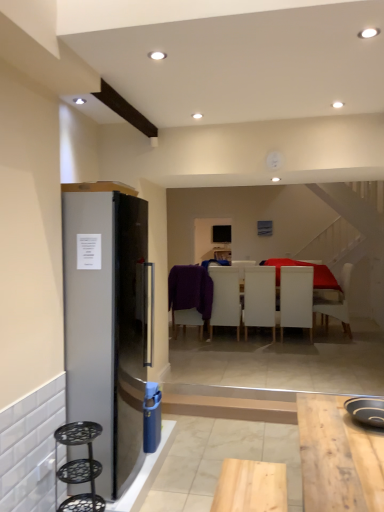
Describe the element at coordinates (225, 298) in the screenshot. I see `white matte chair at center, which ranks as the 2th chair in left-to-right order` at that location.

At what (x,y) coordinates should I click in order to perform the action: click on satin silver refrigerator at left. Please return your answer as a coordinate pair (x, y). This screenshot has height=512, width=384. Looking at the image, I should click on (105, 323).

You are a GUI agent. You are given a task and a screenshot of the screen. Output one action in this format:
    pyautogui.click(x=<x>, y=<y>)
    Task: Click on the purple fabric chair at center, which is the first chair in left-to-right order
    The width and height of the screenshot is (384, 512).
    Given the screenshot: What is the action you would take?
    pos(190,296)

Measure the distance between purple fabric chair at center, which ranks as the 5th chair in right-to-left order, and camera.

The distance of purple fabric chair at center, which ranks as the 5th chair in right-to-left order, from camera is 5.98 meters.

Measure the distance between point (x=75, y=424) and camera.

They are 2.39 meters apart.

The width and height of the screenshot is (384, 512). I want to click on white matte chair at center, which is the third chair from left to right, so click(x=260, y=298).

Looking at this image, are white matte chair at center, which is counted as the fourth chair, starting from the right, and purple fabric chair at center, which is the first chair in left-to-right order, far apart?

white matte chair at center, which is counted as the fourth chair, starting from the right, is near purple fabric chair at center, which is the first chair in left-to-right order, not far away.

Can you confirm if white matte chair at center, which ranks as the 2th chair in left-to-right order, is thinner than purple fabric chair at center, which is the first chair in left-to-right order?

No, white matte chair at center, which ranks as the 2th chair in left-to-right order, is not thinner than purple fabric chair at center, which is the first chair in left-to-right order.

Is white matte chair at center, which ranks as the 2th chair in left-to-right order, positioned with its back to purple fabric chair at center, which ranks as the 5th chair in right-to-left order?

white matte chair at center, which ranks as the 2th chair in left-to-right order, is not turned away from purple fabric chair at center, which ranks as the 5th chair in right-to-left order.

Is point (209, 330) closer to viewer compared to point (202, 294)?

That is False.

Does satin silver refrigerator at left have a greater width compared to white matte chair at center, which is the third chair from left to right?

Indeed, satin silver refrigerator at left has a greater width compared to white matte chair at center, which is the third chair from left to right.

From the image's perspective, is satin silver refrigerator at left positioned above or below white matte chair at center, which is the third chair from left to right?

satin silver refrigerator at left is above white matte chair at center, which is the third chair from left to right.

Looking at this image, from a real-world perspective, between satin silver refrigerator at left and white matte chair at center, which is the third chair from left to right, who is vertically lower?

From a 3D spatial view, white matte chair at center, which is the third chair from left to right, is below.

Which point is more forward, [74,462] or [189,297]?

Point [74,462]

Is black metal bar stool at left beside purple fabric chair at center, which is the first chair in left-to-right order?

There is a gap between black metal bar stool at left and purple fabric chair at center, which is the first chair in left-to-right order.

Which object is closer to the camera, black metal bar stool at left or purple fabric chair at center, which is the first chair in left-to-right order?

black metal bar stool at left is closer to the camera.

Which is more to the left, white matte chair at center, which is the third chair from left to right, or purple fabric chair at center, which is the first chair in left-to-right order?

Positioned to the left is purple fabric chair at center, which is the first chair in left-to-right order.

At what (x,y) coordinates should I click in order to perform the action: click on the 3rd chair positioned below the white matte chair at center, which is the third chair from left to right (from the image's perspective). Please return your answer as a coordinate pair (x, y). Looking at the image, I should click on (190, 296).

Can you confirm if white matte chair at center, which is the third chair from left to right, is shorter than purple fabric chair at center, which ranks as the 5th chair in right-to-left order?

No, white matte chair at center, which is the third chair from left to right, is not shorter than purple fabric chair at center, which ranks as the 5th chair in right-to-left order.

Can we say white matte chair at center, the third chair viewed from the right, lies outside purple fabric chair at center, which is the first chair in left-to-right order?

Indeed, white matte chair at center, the third chair viewed from the right, is completely outside purple fabric chair at center, which is the first chair in left-to-right order.

Does point (287, 297) come in front of point (247, 309)?

Yes, it is in front of point (247, 309).

Considering the relative positions of white matte chair at center, placed as the second chair when sorted from right to left, and white matte chair at center, the third chair viewed from the right, in the image provided, is white matte chair at center, placed as the second chair when sorted from right to left, to the left or to the right of white matte chair at center, the third chair viewed from the right,?

→ From the image, it's evident that white matte chair at center, placed as the second chair when sorted from right to left, is to the right of white matte chair at center, the third chair viewed from the right.

Are white matte chair at center, which appears as the fourth chair when viewed from the left, and white matte chair at center, which is the third chair from left to right, far apart?

white matte chair at center, which appears as the fourth chair when viewed from the left, is near white matte chair at center, which is the third chair from left to right, not far away.

Does white matte chair at center, placed as the second chair when sorted from right to left, lie in front of white matte chair at center, the third chair viewed from the right?

That is True.

Which chair is the 5th one when counting from the back of the satin silver refrigerator at left? Please provide its 2D coordinates.

[(335, 303)]

Is point (138, 455) closer to viewer compared to point (340, 320)?

Yes, it is.

From the image's perspective, relative to white matte chair at center, the fifth chair positioned from the left, is satin silver refrigerator at left above or below?

Based on their image positions, satin silver refrigerator at left is located above white matte chair at center, the fifth chair positioned from the left.

From a real-world perspective, relative to white matte chair at center, which appears as the fourth chair when viewed from the left, is white matte chair at center, the third chair viewed from the right, vertically above or below?

From a real-world perspective, white matte chair at center, the third chair viewed from the right, is physically above white matte chair at center, which appears as the fourth chair when viewed from the left.

Is white matte chair at center, the third chair viewed from the right, taller or shorter than white matte chair at center, placed as the second chair when sorted from right to left?

In the image, white matte chair at center, the third chair viewed from the right, appears to be shorter than white matte chair at center, placed as the second chair when sorted from right to left.

Is the surface of white matte chair at center, the third chair viewed from the right, in direct contact with white matte chair at center, placed as the second chair when sorted from right to left?

No, white matte chair at center, the third chair viewed from the right, is not in contact with white matte chair at center, placed as the second chair when sorted from right to left.

Relative to white matte chair at center, which appears as the fourth chair when viewed from the left, is white matte chair at center, which is the third chair from left to right, in front or behind?

In the image, white matte chair at center, which is the third chair from left to right, appears behind white matte chair at center, which appears as the fourth chair when viewed from the left.

Starting from the white matte chair at center, which is counted as the fourth chair, starting from the right, which chair is the 1st one behind? Please provide its 2D coordinates.

[(190, 296)]

Locate an element on the screen. The width and height of the screenshot is (384, 512). fridge that appears above the white matte chair at center, which is the third chair from left to right (from a real-world perspective) is located at coordinates (105, 323).

When comparing their distances from white matte chair at center, which ranks as the 2th chair in left-to-right order, does black non-stick pan at lower right or white matte chair at center, placed as the second chair when sorted from right to left, seem further?

black non-stick pan at lower right is further to white matte chair at center, which ranks as the 2th chair in left-to-right order.

When comparing their distances from white matte chair at center, the fifth chair positioned from the left, does white matte chair at center, which is the third chair from left to right, or purple fabric chair at center, which ranks as the 5th chair in right-to-left order, seem further?

purple fabric chair at center, which ranks as the 5th chair in right-to-left order, is further to white matte chair at center, the fifth chair positioned from the left.

Estimate the real-world distances between objects in this image. Which object is further from white matte chair at center, which ranks as the 2th chair in left-to-right order, white matte chair at center, placed as the second chair when sorted from right to left, or white matte chair at center, which is the third chair from left to right?

Among the two, white matte chair at center, placed as the second chair when sorted from right to left, is located further to white matte chair at center, which ranks as the 2th chair in left-to-right order.

Based on their spatial positions, is white matte chair at center, which appears as the fourth chair when viewed from the left, or white matte chair at center, which is counted as the fourth chair, starting from the right, closer to white matte chair at center, the third chair viewed from the right?

white matte chair at center, which appears as the fourth chair when viewed from the left, is positioned closer to the anchor white matte chair at center, the third chair viewed from the right.

When comparing their distances from satin silver refrigerator at left, does black non-stick pan at lower right or purple fabric chair at center, which is the first chair in left-to-right order, seem further?

The object further to satin silver refrigerator at left is purple fabric chair at center, which is the first chair in left-to-right order.

Looking at the image, which one is located further to black non-stick pan at lower right, white matte chair at center, the third chair viewed from the right, or satin silver refrigerator at left?

white matte chair at center, the third chair viewed from the right, is further to black non-stick pan at lower right.

Looking at the image, which one is located further to white matte chair at center, which ranks as the 2th chair in left-to-right order, white matte chair at center, which is counted as the 1th chair, starting from the right, or white matte chair at center, which appears as the fourth chair when viewed from the left?

white matte chair at center, which is counted as the 1th chair, starting from the right, lies further to white matte chair at center, which ranks as the 2th chair in left-to-right order, than the other object.

When comparing their distances from satin silver refrigerator at left, does purple fabric chair at center, which ranks as the 5th chair in right-to-left order, or white matte chair at center, the third chair viewed from the right, seem further?

white matte chair at center, the third chair viewed from the right, lies further to satin silver refrigerator at left than the other object.

What are the coordinates of `bar stool between black non-stick pan at lower right and purple fabric chair at center, which is the first chair in left-to-right order, along the z-axis` in the screenshot? It's located at (79, 467).

Find the location of `bar stool between black non-stick pan at lower right and white matte chair at center, the third chair viewed from the right, along the z-axis`. bar stool between black non-stick pan at lower right and white matte chair at center, the third chair viewed from the right, along the z-axis is located at coordinates (79, 467).

This screenshot has width=384, height=512. Find the location of `fridge between black non-stick pan at lower right and purple fabric chair at center, which ranks as the 5th chair in right-to-left order, from front to back`. fridge between black non-stick pan at lower right and purple fabric chair at center, which ranks as the 5th chair in right-to-left order, from front to back is located at coordinates (105, 323).

Locate an element on the screen. This screenshot has height=512, width=384. fridge between black metal bar stool at left and white matte chair at center, placed as the second chair when sorted from right to left, from front to back is located at coordinates (105, 323).